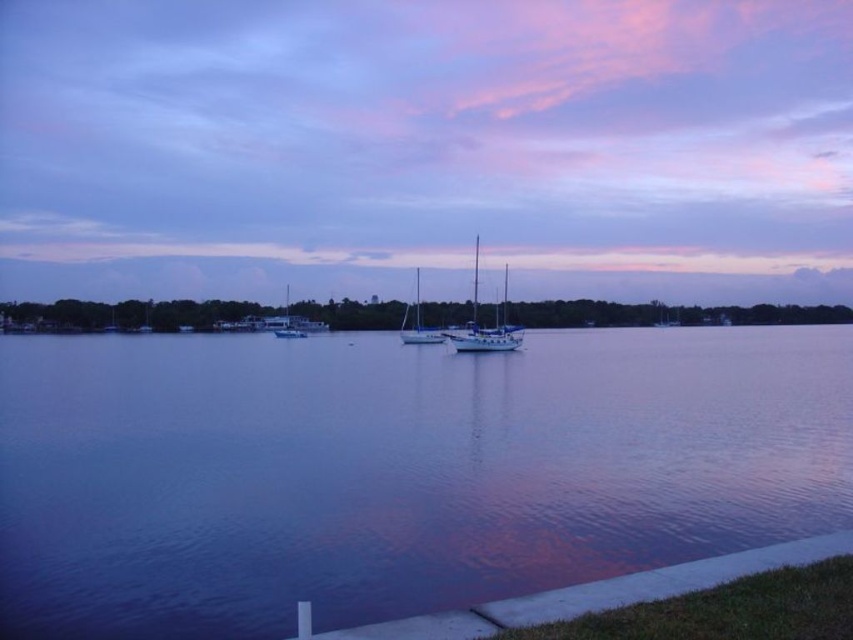
You are standing at the shoreline in the waterfront scene. There is a white glossy sailboat at center located at point (485, 326). If you want to walk towards the white glossy sailboat at center, which direction should you head?

You should head towards the point (485, 326) to reach the white glossy sailboat at center.

You are a photographer planning to take a photo of the waterfront scene. You want to ensure that both the white glossy sailboat at center and the white matte sailboat at center are clearly visible in the frame. Given their sizes, which boat should you position closer to the edge of the frame to avoid overcrowding the composition?

The white glossy sailboat at center is larger in width than the white matte sailboat at center. To avoid overcrowding the composition, you should position the larger white glossy sailboat at center closer to the edge of the frame so that both boats can be accommodated within the shot.

You are standing on the shore and see the smooth water at center and the white glossy sailboat at center. Which object is closer to the horizon?

The smooth water at center is located below the white glossy sailboat at center, meaning the sailboat is closer to the horizon than the water.